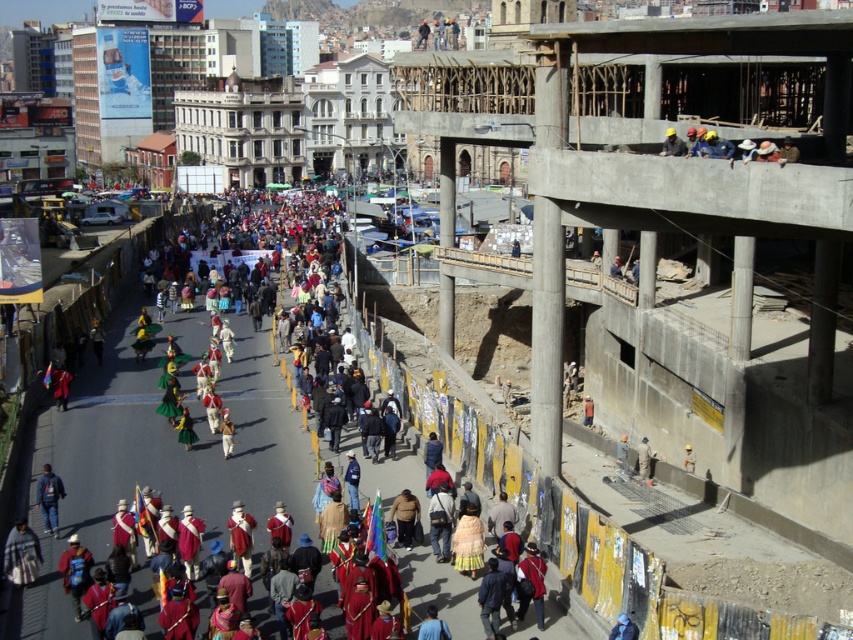
Question: Which object is positioned farthest from the light brown fabric jacket at lower right?

Choices:
 (A) red fabric costumes at center
 (B) brown leather jacket at center

Answer: (A)

Question: Based on their relative distances, which object is nearer to the white fabric at center?

Choices:
 (A) brown leather jacket at center
 (B) red fabric costumes at center
 (C) dark blue backpack at lower left

Answer: (A)

Question: Does hard hat construction worker at upper right lie in front of white fabric at center?

Choices:
 (A) no
 (B) yes

Answer: (B)

Question: Is hard hat construction worker at upper right above white fabric at center?

Choices:
 (A) yes
 (B) no

Answer: (A)

Question: Among these points, which one is nearest to the camera?

Choices:
 (A) (693, 470)
 (B) (99, 538)
 (C) (645, 436)
 (D) (35, 492)

Answer: (B)

Question: Is light brown fabric jacket at lower right positioned behind hard hat construction worker at upper right?

Choices:
 (A) no
 (B) yes

Answer: (B)